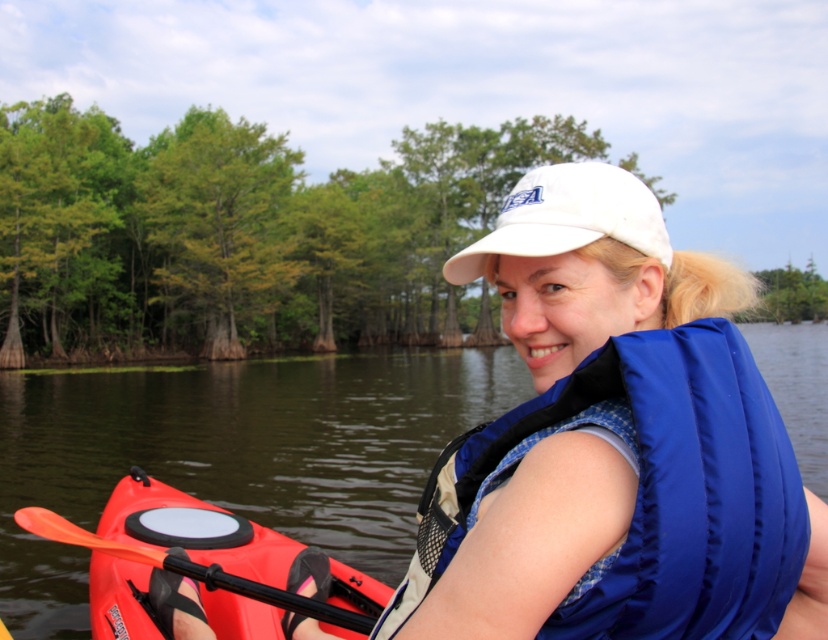
Question: Does blue fabric life jacket at center lie in front of orange plastic paddle at lower left?

Choices:
 (A) yes
 (B) no

Answer: (A)

Question: In this image, where is blue fabric life jacket at center located relative to white fabric baseball cap at center?

Choices:
 (A) left
 (B) right

Answer: (A)

Question: Can you confirm if blue fabric life jacket at center is positioned above white fabric baseball cap at center?

Choices:
 (A) no
 (B) yes

Answer: (A)

Question: Which of these objects is positioned farthest from the white fabric baseball cap at center?

Choices:
 (A) orange plastic paddle at lower left
 (B) blue fabric life jacket at center

Answer: (A)

Question: Which point appears farthest from the camera in this image?

Choices:
 (A) (745, 420)
 (B) (26, 508)
 (C) (552, 202)

Answer: (B)

Question: Which of the following is the farthest from the observer?

Choices:
 (A) orange plastic paddle at lower left
 (B) blue fabric life jacket at center
 (C) white fabric baseball cap at center

Answer: (A)